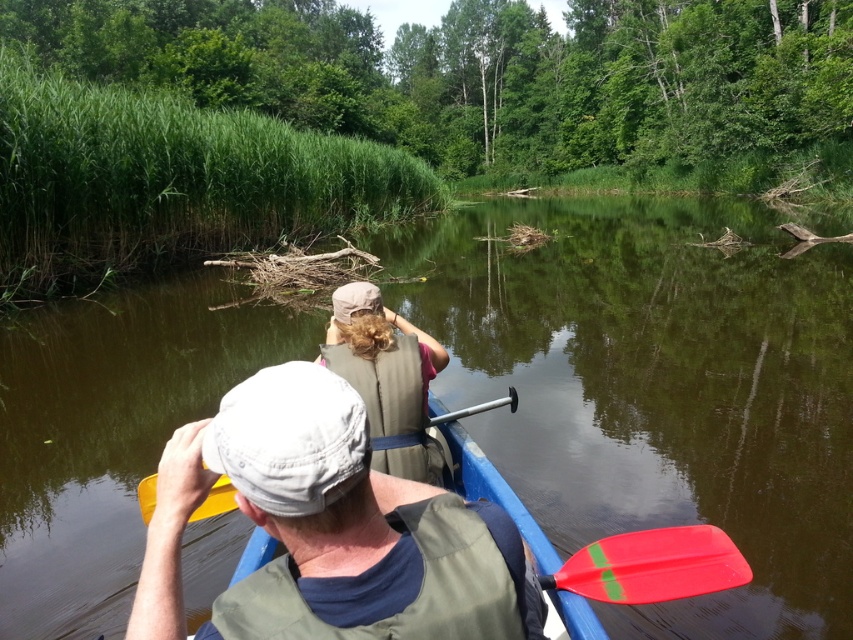
Consider the image. You are in a kayak and need to reach an item that is floating in the water. The item is located between the beige fabric life vest at center and the red plastic paddle at lower center. Which item is closer to the water surface?

The red plastic paddle at lower center is closer to the water surface because it is positioned lower than the beige fabric life vest at center.

You are in a kayak and need to reach an item floating near the center of the water. You have the matte gray cap at center and the red plastic paddle at center. Which item is taller and can be used to reach the floating object more effectively?

The matte gray cap at center is taller than the red plastic paddle at center, so it can be used to reach the floating object more effectively.

You are in a kayak and need to avoid hitting a submerged rock. The coordinates of the rock are at point (656,387). Where should you steer your kayak to avoid it?

The brown murky water at center is located at point (656,387), which indicates the presence of the submerged rock. To avoid it, steer your kayak away from the center towards the edges where the water is clearer.